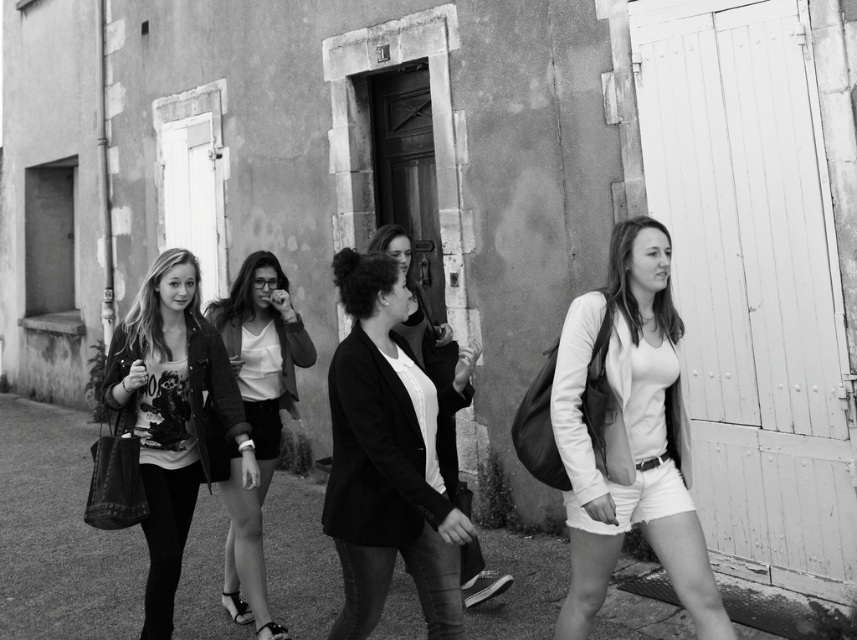
Who is shorter, smooth concrete pavement at center or matte black jacket at center?

Standing shorter between the two is smooth concrete pavement at center.

Is smooth concrete pavement at center above matte black jacket at center?

No, smooth concrete pavement at center is not above matte black jacket at center.

Is point (214, 634) positioned before point (366, 349)?

No.

The width and height of the screenshot is (857, 640). I want to click on smooth concrete pavement at center, so click(x=58, y=534).

From the picture: Between white matte shorts at lower right and matte black blazer at center, which one appears on the right side from the viewer's perspective?

white matte shorts at lower right is more to the right.

Who is taller, white matte shorts at lower right or matte black blazer at center?

With more height is matte black blazer at center.

Is point (688, 524) farther from camera compared to point (277, 384)?

That is False.

You are a GUI agent. You are given a task and a screenshot of the screen. Output one action in this format:
    pyautogui.click(x=<x>, y=<y>)
    Task: Click on the white matte shorts at lower right
    This screenshot has width=857, height=640.
    Given the screenshot: What is the action you would take?
    pyautogui.click(x=630, y=436)

Does point (340, 276) lie in front of point (261, 608)?

Yes, it is in front of point (261, 608).

Who is lower down, matte black jacket at center or matte black blazer at center?

matte black blazer at center is below.

Who is more distant from viewer, (434, 557) or (271, 474)?

Positioned behind is point (271, 474).

You are a GUI agent. You are given a task and a screenshot of the screen. Output one action in this format:
    pyautogui.click(x=<x>, y=<y>)
    Task: Click on the matte black jacket at center
    
    Given the screenshot: What is the action you would take?
    pyautogui.click(x=387, y=460)